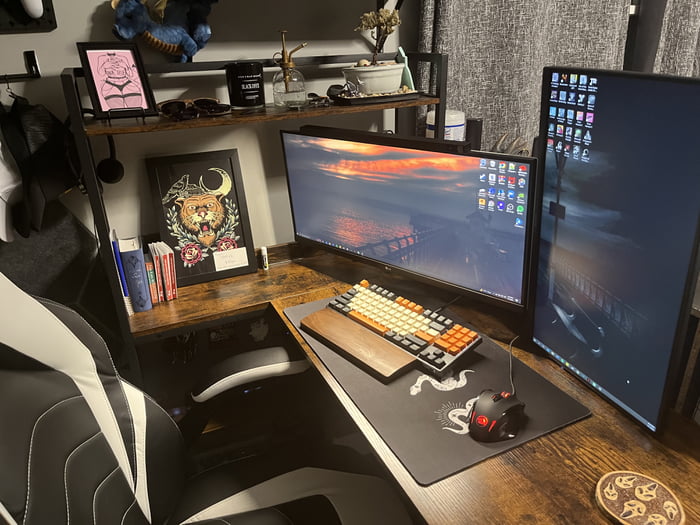
Find the location of a particular element. Image resolution: width=700 pixels, height=525 pixels. coaster is located at coordinates (638, 505).